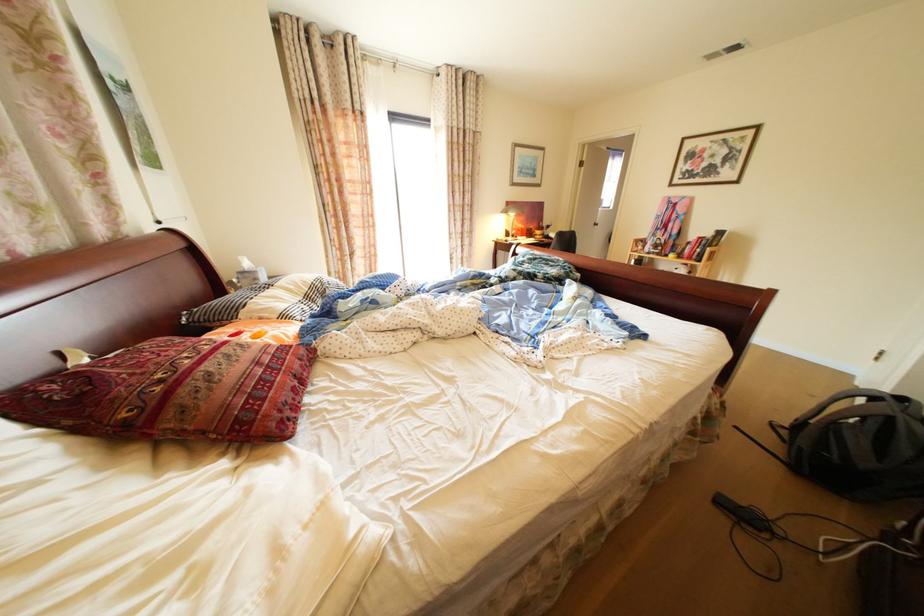
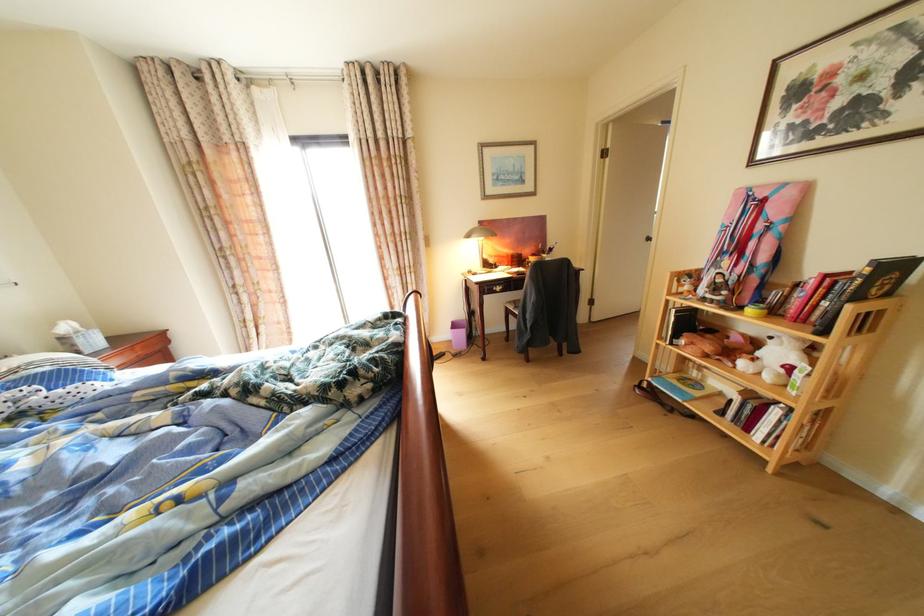
In a continuous first-person perspective shot, in which direction is the camera moving?

The movement direction of the cameraman is right, forward.